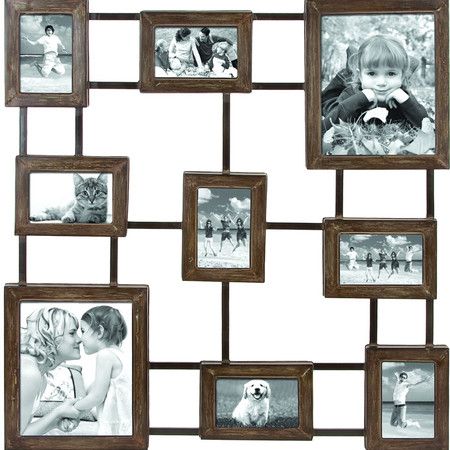
Locate an element on the screen. Image resolution: width=450 pixels, height=450 pixels. photo frames is located at coordinates (398, 387), (385, 271), (378, 129), (229, 52), (53, 80), (66, 188), (103, 336), (214, 226), (247, 403).